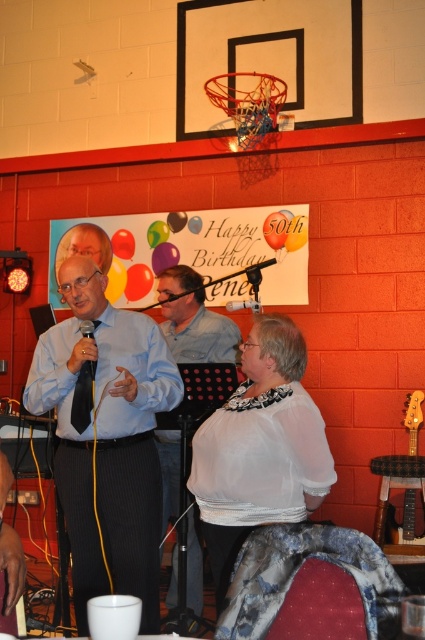
Can you confirm if light blue shirt at center is bigger than purple glossy balloon at upper center?

Yes, light blue shirt at center is bigger than purple glossy balloon at upper center.

Looking at this image, does light blue shirt at center have a lesser height compared to purple glossy balloon at upper center?

Incorrect, light blue shirt at center's height does not fall short of purple glossy balloon at upper center's.

Does point (105, 470) come closer to viewer compared to point (144, 278)?

Yes, point (105, 470) is closer to viewer.

Where is `light blue shirt at center`? The image size is (425, 640). light blue shirt at center is located at coordinates (107, 438).

Which is above, white sheer blouse at center or black silk tie at center?

Positioned higher is black silk tie at center.

Who is taller, white sheer blouse at center or black silk tie at center?

With more height is white sheer blouse at center.

Measure the distance between white sheer blouse at center and camera.

white sheer blouse at center and camera are 2.28 meters apart from each other.

Image resolution: width=425 pixels, height=640 pixels. What are the coordinates of `white sheer blouse at center` in the screenshot? It's located at (260, 449).

Between point (286, 236) and point (119, 289), which one is positioned in front?

Point (286, 236) is in front.

Who is taller, multicolored latex balloon at center or yellow paper balloon at upper left?

With more height is yellow paper balloon at upper left.

Is point (272, 241) in front of point (121, 269)?

Yes, point (272, 241) is closer to viewer.

Image resolution: width=425 pixels, height=640 pixels. I want to click on multicolored latex balloon at center, so click(x=275, y=228).